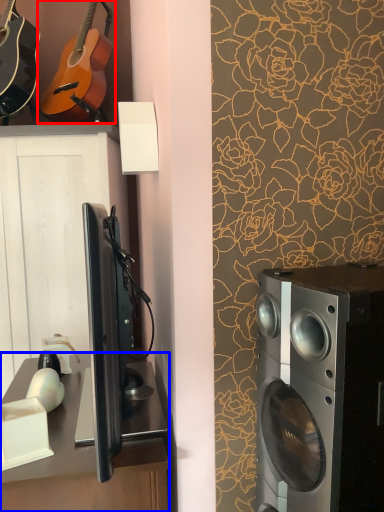
Question: Among these objects, which one is nearest to the camera, guitar (highlighted by a red box) or desk (highlighted by a blue box)?

Choices:
 (A) guitar
 (B) desk

Answer: (B)